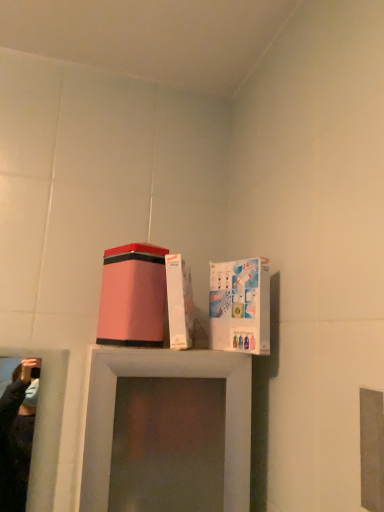
Question: Is matte pink box at center turned away from white glossy cardboard box at upper right?

Choices:
 (A) yes
 (B) no

Answer: (B)

Question: Are matte pink box at center and white glossy cardboard box at upper right making contact?

Choices:
 (A) no
 (B) yes

Answer: (A)

Question: From the image's perspective, is matte pink box at center located beneath white glossy cardboard box at upper right?

Choices:
 (A) no
 (B) yes

Answer: (A)

Question: From a real-world perspective, is matte pink box at center over white glossy cardboard box at upper right?

Choices:
 (A) no
 (B) yes

Answer: (B)

Question: Can you confirm if matte pink box at center is shorter than white glossy cardboard box at upper right?

Choices:
 (A) yes
 (B) no

Answer: (A)

Question: Are matte pink box at center and white glossy cardboard box at upper right far apart?

Choices:
 (A) no
 (B) yes

Answer: (A)

Question: Is white glossy cardboard box at upper right far away from matte pink box at center?

Choices:
 (A) no
 (B) yes

Answer: (A)

Question: Is white glossy cardboard box at upper right wider than matte pink box at center?

Choices:
 (A) no
 (B) yes

Answer: (A)

Question: Is white glossy cardboard box at upper right thinner than matte pink box at center?

Choices:
 (A) yes
 (B) no

Answer: (A)

Question: Considering the relative positions of white glossy cardboard box at upper right and matte pink box at center in the image provided, is white glossy cardboard box at upper right behind matte pink box at center?

Choices:
 (A) yes
 (B) no

Answer: (B)

Question: Can matte pink box at center be found inside white glossy cardboard box at upper right?

Choices:
 (A) yes
 (B) no

Answer: (B)

Question: Can we say white glossy cardboard box at upper right lies outside matte pink box at center?

Choices:
 (A) yes
 (B) no

Answer: (A)

Question: Is point (230, 271) closer or farther from the camera than point (137, 268)?

Choices:
 (A) farther
 (B) closer

Answer: (A)